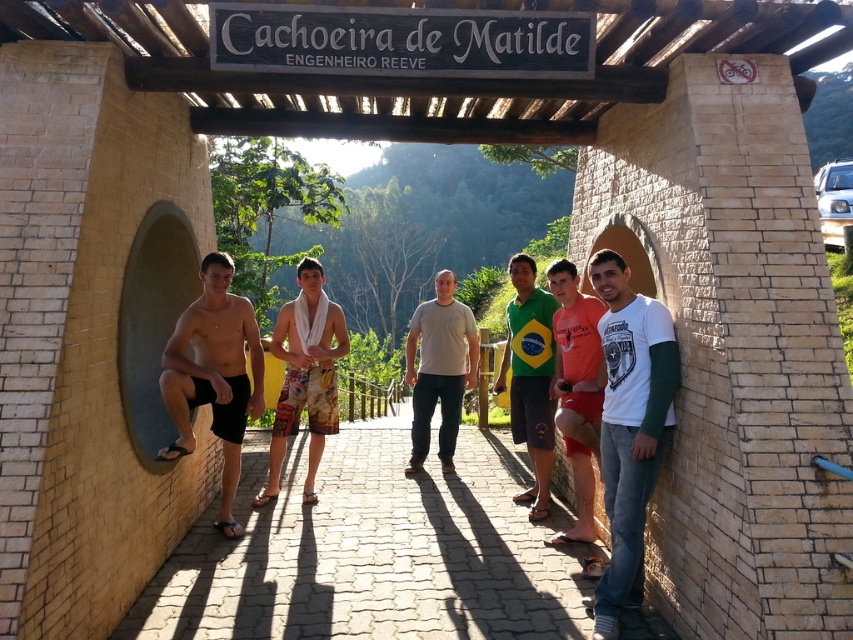
Question: Which object is closer to the camera taking this photo?

Choices:
 (A) paved stone path at center
 (B) orange cotton shorts at center

Answer: (A)

Question: Which of the following is the farthest from the observer?

Choices:
 (A) (585, 397)
 (B) (534, 548)

Answer: (B)

Question: Among these objects, which one is nearest to the camera?

Choices:
 (A) dark gray wood sign at center
 (B) black matte shorts at left

Answer: (A)

Question: Is dark gray wood sign at center closer to the viewer compared to black matte shorts at left?

Choices:
 (A) yes
 (B) no

Answer: (A)

Question: Can you confirm if dark gray wood sign at center is positioned to the right of light gray cotton t-shirt at center?

Choices:
 (A) no
 (B) yes

Answer: (A)

Question: Is black matte shorts at left to the right of gray concrete wall at left from the viewer's perspective?

Choices:
 (A) no
 (B) yes

Answer: (B)